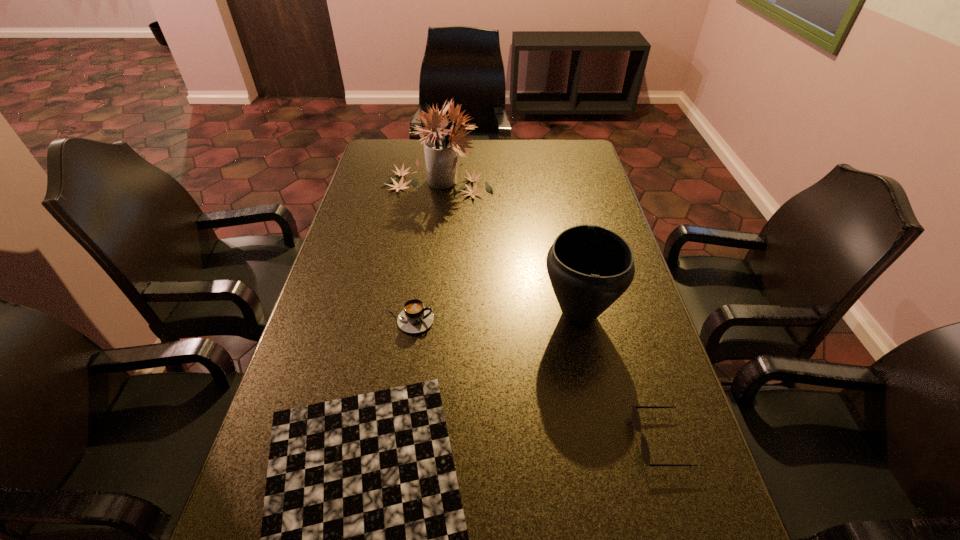
Locate an element on the screen. vacant space located on the front-facing side of the sunglasses is located at coordinates (470, 441).

Locate an element on the screen. Image resolution: width=960 pixels, height=540 pixels. object that is positioned at the far edge is located at coordinates (441, 145).

In order to click on object that is at the left edge in this screenshot , I will do `click(441, 145)`.

Locate an element on the screen. urn that is positioned at the right edge is located at coordinates [589, 266].

Where is `sunglasses present at the right edge`? The width and height of the screenshot is (960, 540). sunglasses present at the right edge is located at coordinates (636, 422).

In order to click on object that is at the far left corner in this screenshot , I will do `click(441, 145)`.

Locate an element on the screen. vacant space at the far edge of the desktop is located at coordinates tap(507, 139).

In the image, there is a desktop. In order to click on vacant space at the left edge in this screenshot , I will do `click(373, 239)`.

You are a GUI agent. You are given a task and a screenshot of the screen. Output one action in this format:
    pyautogui.click(x=<x>, y=<y>)
    Task: Click on the free space at the right edge of the desktop
    
    Given the screenshot: What is the action you would take?
    pyautogui.click(x=673, y=390)

Image resolution: width=960 pixels, height=540 pixels. I want to click on vacant space at the far right corner of the desktop, so point(561,145).